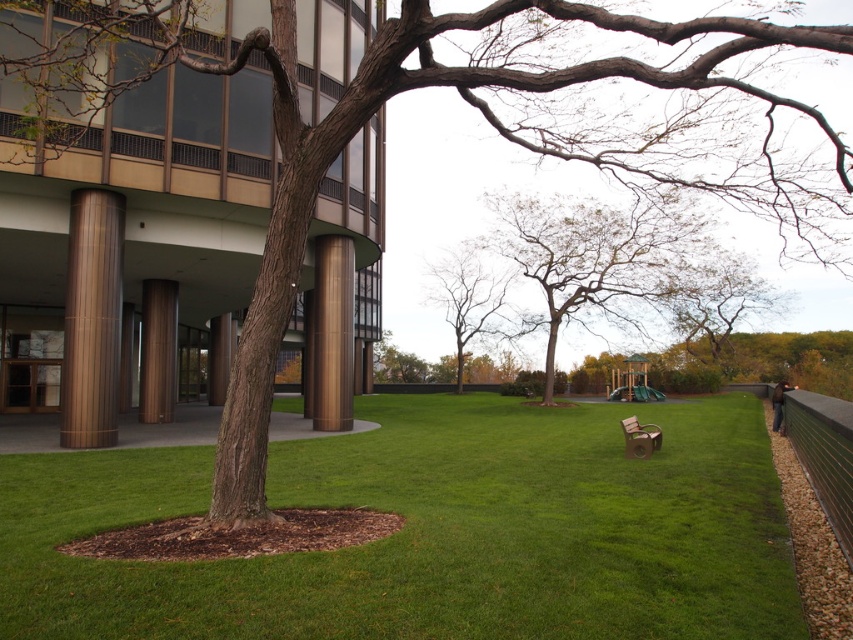
Is brown polished column at left smaller than bare branches at center?

Correct, brown polished column at left occupies less space than bare branches at center.

Image resolution: width=853 pixels, height=640 pixels. Describe the element at coordinates (91, 321) in the screenshot. I see `brown polished column at left` at that location.

Between point (70, 266) and point (486, 314), which one is positioned in front?

Point (70, 266)

This screenshot has height=640, width=853. Identify the location of brown polished column at left. (91, 321).

Image resolution: width=853 pixels, height=640 pixels. Identify the location of bronze polished pillar at center. (332, 333).

Which is behind, point (318, 401) or point (434, 289)?

The point (434, 289) is behind.

Locate an element on the screen. The height and width of the screenshot is (640, 853). bronze polished pillar at center is located at coordinates (332, 333).

Does bronze polished pillar at center have a greater width compared to brown polished pillar at center?

Indeed, bronze polished pillar at center has a greater width compared to brown polished pillar at center.

Between point (328, 417) and point (227, 317), which one is positioned in front?

Point (328, 417) is more forward.

Where is `bronze polished pillar at center`? The height and width of the screenshot is (640, 853). bronze polished pillar at center is located at coordinates (332, 333).